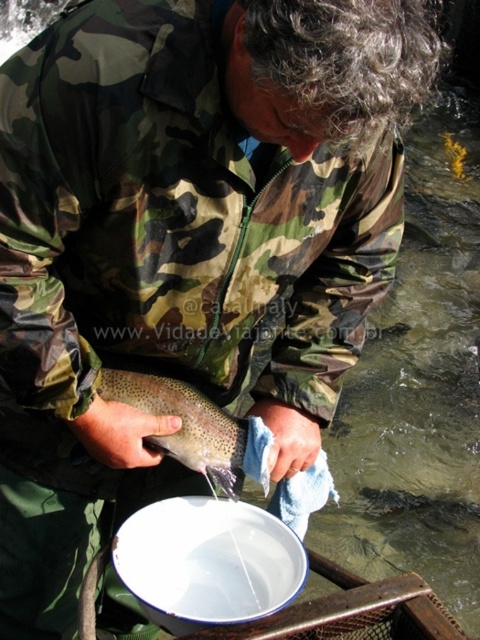
Question: Does white enamel plate at lower center appear on the right side of speckled skin fish at center?

Choices:
 (A) yes
 (B) no

Answer: (A)

Question: Which object is closer to the camera taking this photo?

Choices:
 (A) white enamel plate at lower center
 (B) speckled skin fish at center

Answer: (A)

Question: Is white enamel plate at lower center bigger than speckled skin fish at center?

Choices:
 (A) no
 (B) yes

Answer: (A)

Question: Is white enamel plate at lower center positioned before speckled skin fish at center?

Choices:
 (A) yes
 (B) no

Answer: (A)